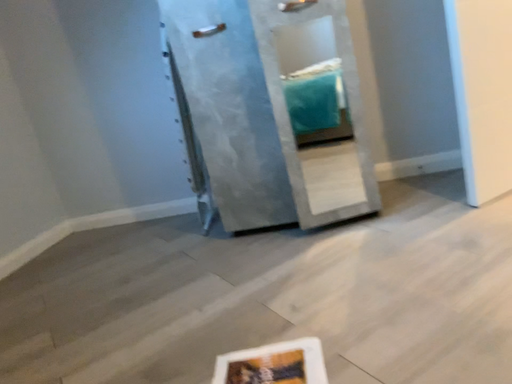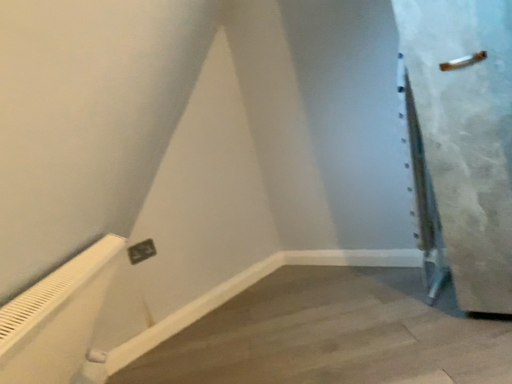
Question: Which way did the camera rotate in the video?

Choices:
 (A) rotated right
 (B) rotated left

Answer: (B)